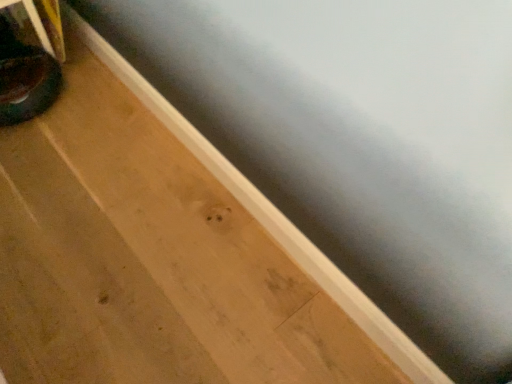
Identify the location of free spot above shiny brown shoe at left (from a real-world perspective). (22, 71).